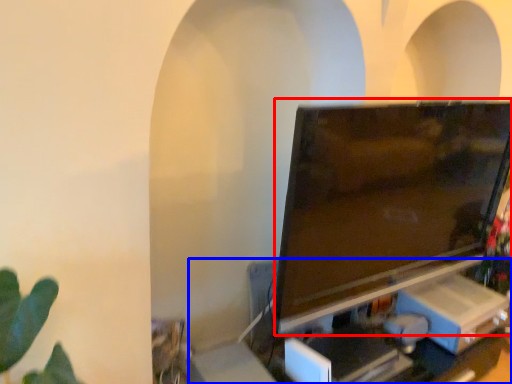
Question: Which object appears farthest to the camera in this image, television (highlighted by a red box) or computer desk (highlighted by a blue box)?

Choices:
 (A) television
 (B) computer desk

Answer: (B)